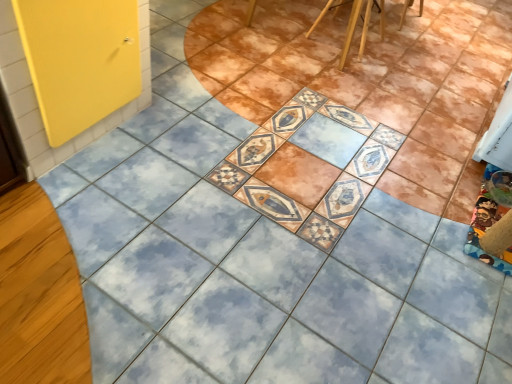
Question: Looking at their shapes, would you say wooden chair at upper center is wider or thinner than wooden chair at upper center?

Choices:
 (A) wide
 (B) thin

Answer: (A)

Question: From their relative heights in the image, would you say wooden chair at upper center is taller or shorter than wooden chair at upper center?

Choices:
 (A) short
 (B) tall

Answer: (B)

Question: Which object is the closest to the wooden chair at upper center?

Choices:
 (A) wooden chair at upper center
 (B) yellow matte door at left

Answer: (A)

Question: Which object is the farthest from the yellow matte door at left?

Choices:
 (A) wooden chair at upper center
 (B) wooden chair at upper center

Answer: (A)